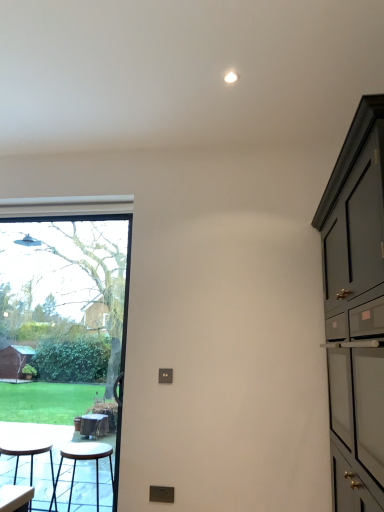
Question: Does transparent glass window at left lie behind matte dark green cabinet at right?

Choices:
 (A) yes
 (B) no

Answer: (A)

Question: Is transparent glass window at left next to matte dark green cabinet at right and touching it?

Choices:
 (A) yes
 (B) no

Answer: (B)

Question: From a real-world perspective, is transparent glass window at left over matte dark green cabinet at right?

Choices:
 (A) no
 (B) yes

Answer: (A)

Question: Can you confirm if transparent glass window at left is positioned to the right of matte dark green cabinet at right?

Choices:
 (A) no
 (B) yes

Answer: (A)

Question: Is transparent glass window at left positioned with its back to matte dark green cabinet at right?

Choices:
 (A) yes
 (B) no

Answer: (B)

Question: From the image's perspective, would you say transparent glass window at left is positioned over matte dark green cabinet at right?

Choices:
 (A) yes
 (B) no

Answer: (B)

Question: Is metallic stool at lower left, marked as the 2th stool in a left-to-right arrangement, taller than matte black stool at lower left, positioned as the 1th stool in left-to-right order?

Choices:
 (A) yes
 (B) no

Answer: (B)

Question: Could you tell me if metallic stool at lower left, marked as the 2th stool in a left-to-right arrangement, is turned towards matte black stool at lower left, which is the second stool from right to left?

Choices:
 (A) no
 (B) yes

Answer: (A)

Question: Can you confirm if metallic stool at lower left, which is the 1th stool from right to left, is smaller than matte black stool at lower left, positioned as the 1th stool in left-to-right order?

Choices:
 (A) no
 (B) yes

Answer: (B)

Question: Considering the relative positions of metallic stool at lower left, marked as the 2th stool in a left-to-right arrangement, and matte black stool at lower left, positioned as the 1th stool in left-to-right order, in the image provided, is metallic stool at lower left, marked as the 2th stool in a left-to-right arrangement, to the left of matte black stool at lower left, positioned as the 1th stool in left-to-right order, from the viewer's perspective?

Choices:
 (A) no
 (B) yes

Answer: (A)

Question: Considering the relative positions of metallic stool at lower left, which is the 1th stool from right to left, and matte black stool at lower left, which is the second stool from right to left, in the image provided, is metallic stool at lower left, which is the 1th stool from right to left, behind matte black stool at lower left, which is the second stool from right to left,?

Choices:
 (A) yes
 (B) no

Answer: (B)

Question: Is metallic stool at lower left, which is the 1th stool from right to left, oriented away from matte black stool at lower left, which is the second stool from right to left?

Choices:
 (A) yes
 (B) no

Answer: (B)

Question: Is metallic stool at lower left, marked as the 2th stool in a left-to-right arrangement, turned away from transparent glass window at left?

Choices:
 (A) yes
 (B) no

Answer: (A)